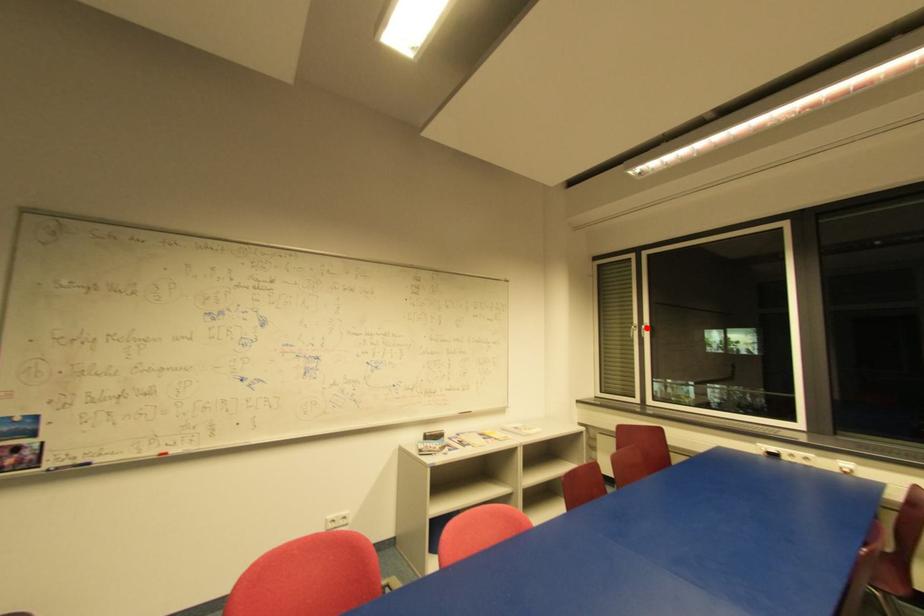
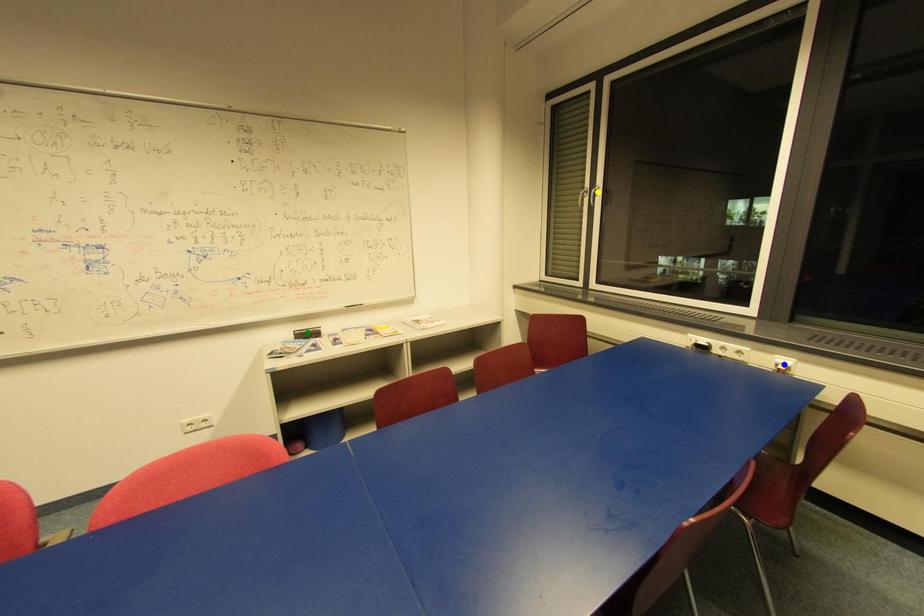
Question: I am providing you with two images of the same scene from different viewpoints. A red point is marked on the first image. You are given multiple points on the second image. Can you choose the point in image 2 that corresponds to the point in image 1?

Choices:
 (A) blue point
 (B) green point
 (C) yellow point

Answer: (C)